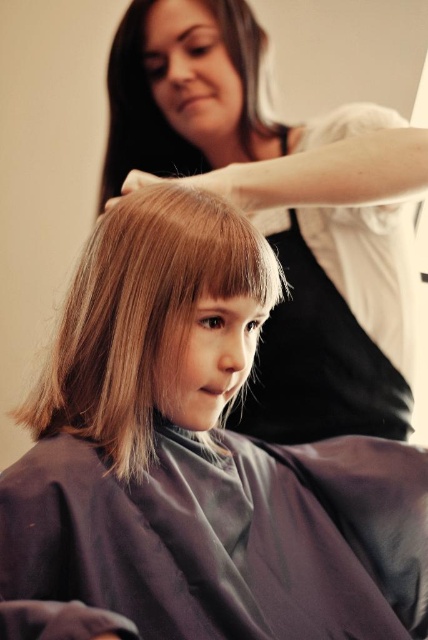
Does point (285, 376) come farther from viewer compared to point (309, 333)?

Yes.

Which is more to the right, matte white shirt at upper center or black fabric apron at upper center?

From the viewer's perspective, black fabric apron at upper center appears more on the right side.

I want to click on matte white shirt at upper center, so click(232, 115).

Image resolution: width=428 pixels, height=640 pixels. What are the coordinates of `matte white shirt at upper center` in the screenshot? It's located at (232, 115).

Who is lower down, blonde hair at center or blonde smooth hair at center?

Positioned lower is blonde hair at center.

Between point (110, 474) and point (109, 307), which one is positioned behind?

The point (109, 307) is behind.

Between point (142, 355) and point (234, 316), which one is positioned in front?

Point (142, 355) is more forward.

The image size is (428, 640). What are the coordinates of `blonde hair at center` in the screenshot? It's located at (199, 456).

Find the location of `blonde hair at center`. blonde hair at center is located at coordinates (199, 456).

Which is in front, point (416, 541) or point (276, 131)?

Positioned in front is point (416, 541).

Locate an element on the screen. The height and width of the screenshot is (640, 428). blonde hair at center is located at coordinates (199, 456).